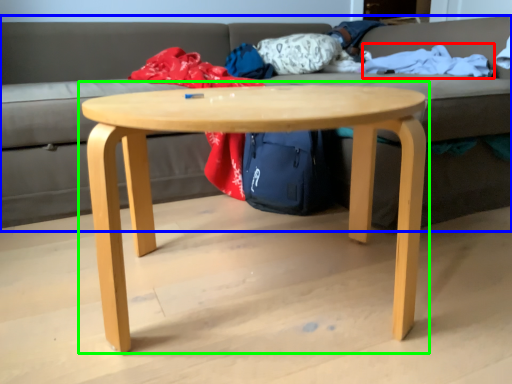
Question: Which object is the closest to the blanket (highlighted by a red box)? Choose among these: studio couch (highlighted by a blue box) or coffee table (highlighted by a green box).

Choices:
 (A) studio couch
 (B) coffee table

Answer: (B)